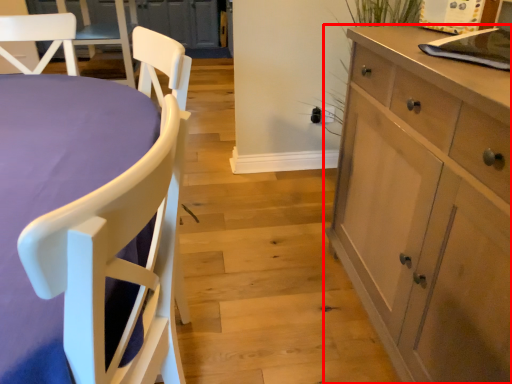
Question: From the image, what is the correct spatial relationship of cabinetry (annotated by the red box) in relation to chair?

Choices:
 (A) right
 (B) left

Answer: (A)